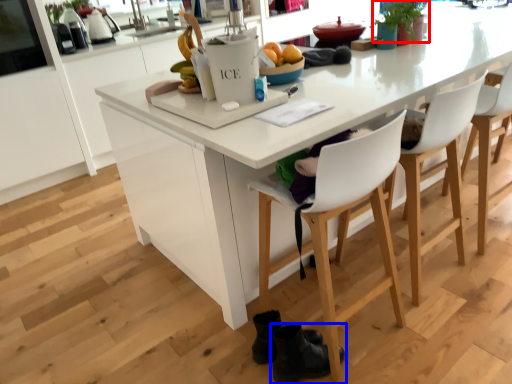
Question: Which point is further to the camera, plant (highlighted by a red box) or footwear (highlighted by a blue box)?

Choices:
 (A) plant
 (B) footwear

Answer: (A)